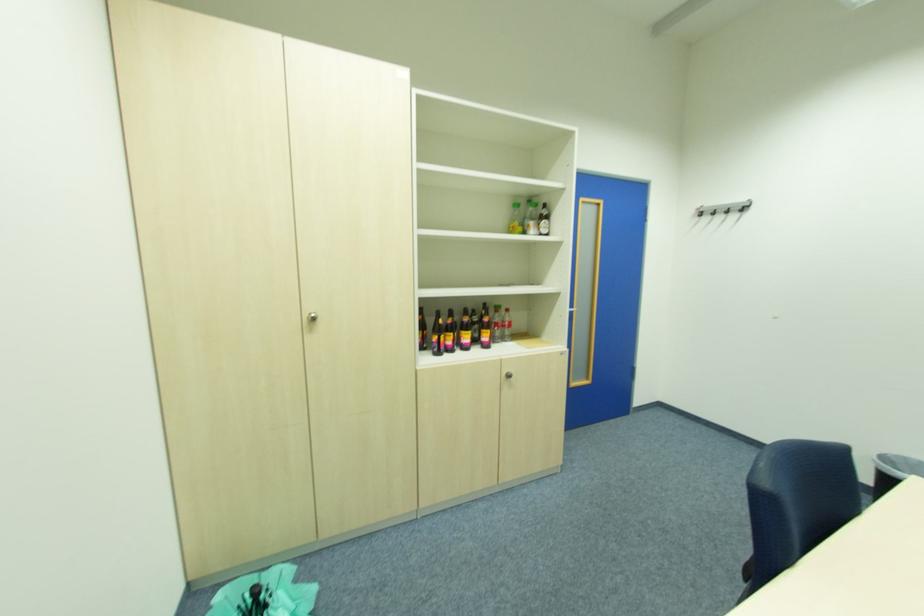
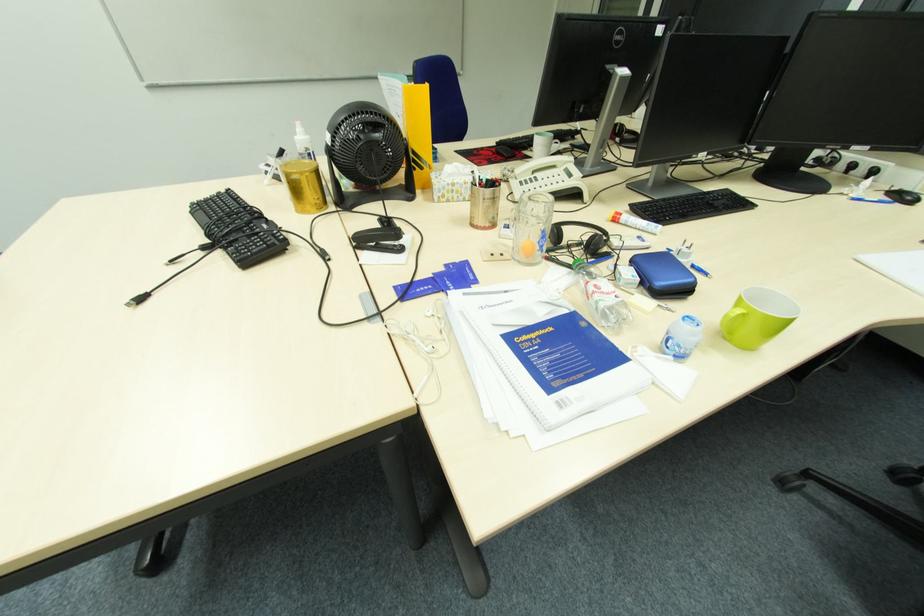
In the scene shown: First-person continuous shooting, in which direction is the camera rotating?

The camera rotated toward right-down.